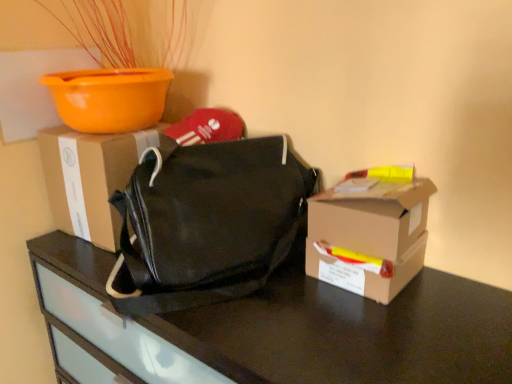
Locate an element on the screen. Image resolution: width=512 pixels, height=384 pixels. vacant region in front of brown cardboard box at right, placed as the 2th box when sorted from back to front is located at coordinates (376, 342).